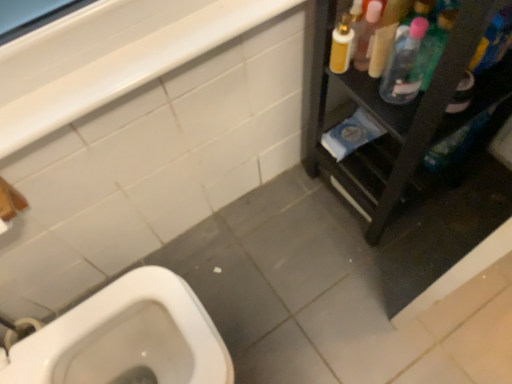
Question: Should I look upward or downward to see clear plastic bottle at upper right, placed as the first cleaning product when sorted from left to right?

Choices:
 (A) up
 (B) down

Answer: (A)

Question: From a real-world perspective, is clear plastic bottle at upper right, placed as the first cleaning product when sorted from left to right, located beneath white glossy balustrade at upper left?

Choices:
 (A) yes
 (B) no

Answer: (A)

Question: Are clear plastic bottle at upper right, acting as the second cleaning product starting from the right, and white glossy balustrade at upper left making contact?

Choices:
 (A) no
 (B) yes

Answer: (A)

Question: Is clear plastic bottle at upper right, placed as the first cleaning product when sorted from left to right, taller than white glossy balustrade at upper left?

Choices:
 (A) yes
 (B) no

Answer: (A)

Question: Does clear plastic bottle at upper right, placed as the first cleaning product when sorted from left to right, lie in front of white glossy balustrade at upper left?

Choices:
 (A) no
 (B) yes

Answer: (A)

Question: Does clear plastic bottle at upper right, acting as the second cleaning product starting from the right, have a greater width compared to white glossy balustrade at upper left?

Choices:
 (A) yes
 (B) no

Answer: (B)

Question: Considering the relative positions of clear plastic bottle at upper right, placed as the first cleaning product when sorted from left to right, and white glossy balustrade at upper left in the image provided, is clear plastic bottle at upper right, placed as the first cleaning product when sorted from left to right, to the left of white glossy balustrade at upper left from the viewer's perspective?

Choices:
 (A) yes
 (B) no

Answer: (B)

Question: Does translucent plastic spray bottle at upper right, which is the first cleaning product from right to left, have a greater width compared to black plastic shelf at right?

Choices:
 (A) no
 (B) yes

Answer: (A)

Question: Does translucent plastic spray bottle at upper right, placed as the 2th cleaning product when sorted from left to right, have a larger size compared to black plastic shelf at right?

Choices:
 (A) no
 (B) yes

Answer: (A)

Question: Is translucent plastic spray bottle at upper right, which is the first cleaning product from right to left, not close to black plastic shelf at right?

Choices:
 (A) yes
 (B) no

Answer: (B)

Question: Considering the relative sizes of translucent plastic spray bottle at upper right, placed as the 2th cleaning product when sorted from left to right, and black plastic shelf at right in the image provided, is translucent plastic spray bottle at upper right, placed as the 2th cleaning product when sorted from left to right, smaller than black plastic shelf at right?

Choices:
 (A) no
 (B) yes

Answer: (B)

Question: From the image's perspective, is translucent plastic spray bottle at upper right, placed as the 2th cleaning product when sorted from left to right, below black plastic shelf at right?

Choices:
 (A) no
 (B) yes

Answer: (A)

Question: Can you confirm if translucent plastic spray bottle at upper right, which is the first cleaning product from right to left, is thinner than black plastic shelf at right?

Choices:
 (A) no
 (B) yes

Answer: (B)

Question: Can you confirm if black plastic shelf at right is smaller than white glossy balustrade at upper left?

Choices:
 (A) no
 (B) yes

Answer: (A)